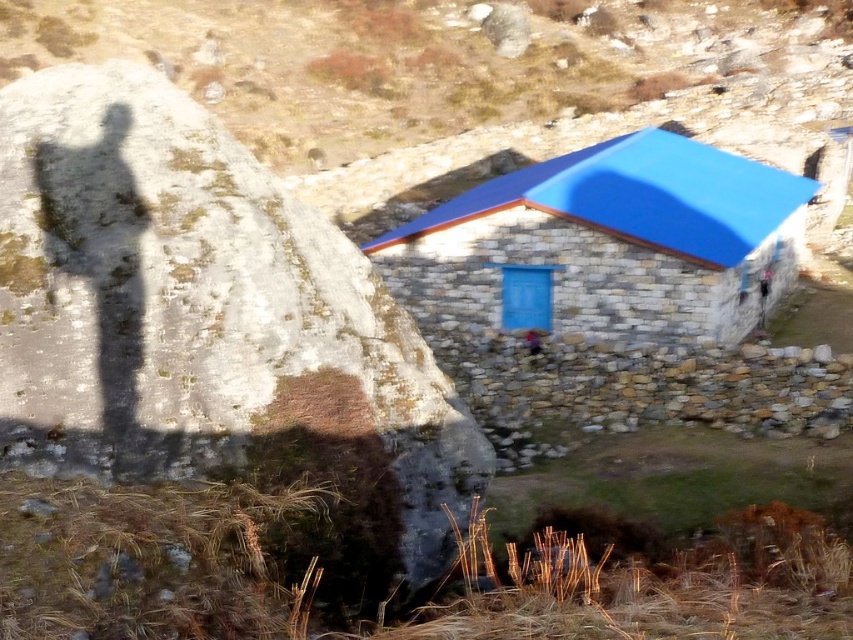
You are standing in front of the blue stone hut at center and want to move to the rusty stone boulder at left. Which direction should you walk to get there?

You should walk to the left to reach the rusty stone boulder at left from the blue stone hut at center.

You are standing in front of the rustic stone building and want to take a photo of both the rusty stone boulder at left and the blue stone hut at center. Which object should you position closer to the camera to ensure both are in focus?

Since the rusty stone boulder at left is closer to the viewer than the blue stone hut at center, you should position the camera closer to the boulder to ensure both are in focus.